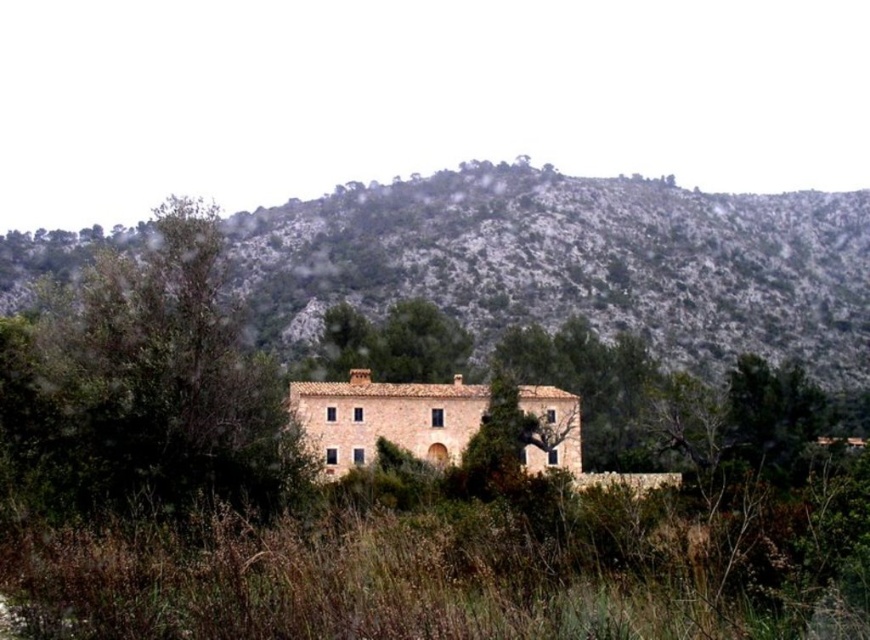
Question: Is green mossy hillside at center behind green leafy tree at center?

Choices:
 (A) yes
 (B) no

Answer: (A)

Question: Is green mossy hillside at center smaller than green leafy tree at center?

Choices:
 (A) yes
 (B) no

Answer: (B)

Question: Does green mossy hillside at center have a lesser width compared to green leafy tree at center?

Choices:
 (A) no
 (B) yes

Answer: (A)

Question: Which of the following is the closest to the observer?

Choices:
 (A) (332, 230)
 (B) (261, 449)

Answer: (B)

Question: Which object is closer to the camera taking this photo?

Choices:
 (A) green leafy tree at center
 (B) green mossy hillside at center

Answer: (A)

Question: Which object appears closest to the camera in this image?

Choices:
 (A) green mossy hillside at center
 (B) green leafy tree at center

Answer: (B)